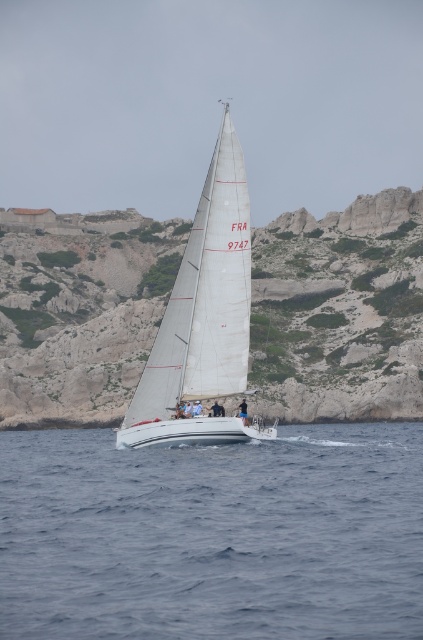
Who is higher up, blue water at center or rocky cliff at center?

rocky cliff at center is above.

Is point (10, 616) closer to camera compared to point (364, 342)?

Yes, it is.

Identify the location of blue water at center. (213, 536).

Who is taller, blue water at center or white sail at center?

Standing taller between the two is white sail at center.

At what (x,y) coordinates should I click in order to perform the action: click on blue water at center. Please return your answer as a coordinate pair (x, y). Looking at the image, I should click on (x=213, y=536).

From the picture: Is rocky cliff at center bigger than white sail at center?

Yes.

Is rocky cliff at center shorter than white sail at center?

Correct, rocky cliff at center is not as tall as white sail at center.

Measure the distance between point (76, 371) and camera.

They are 131.98 meters apart.

What are the coordinates of `rocky cliff at center` in the screenshot? It's located at 340,310.